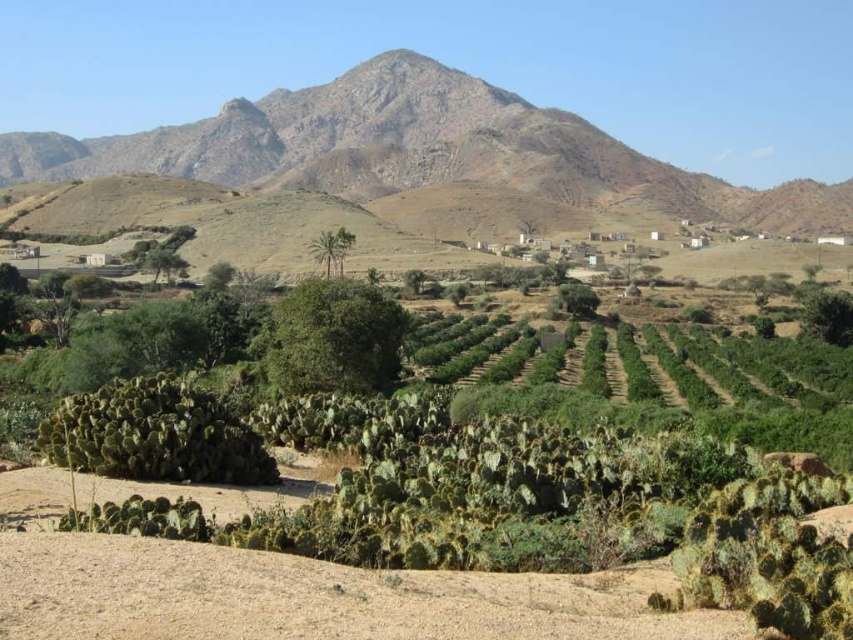
Question: Which of the following is the farthest from the observer?

Choices:
 (A) (456, 481)
 (B) (683, 170)

Answer: (B)

Question: In this image, where is green spiny cactus at center located relative to rugged brown mountain at upper center?

Choices:
 (A) right
 (B) left

Answer: (A)

Question: Does green spiny cactus at center appear over rugged brown mountain at upper center?

Choices:
 (A) yes
 (B) no

Answer: (B)

Question: Does green spiny cactus at center have a larger size compared to rugged brown mountain at upper center?

Choices:
 (A) no
 (B) yes

Answer: (A)

Question: Which point is farther to the camera?

Choices:
 (A) (383, 180)
 (B) (207, 582)

Answer: (A)

Question: Which of the following is the closest to the observer?

Choices:
 (A) rugged brown mountain at upper center
 (B) green spiny cactus at center

Answer: (B)